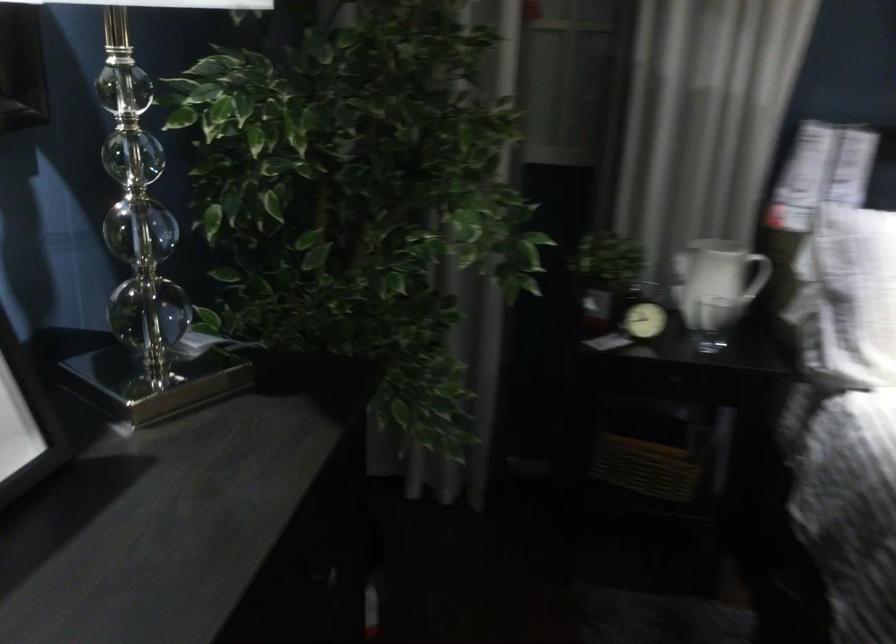
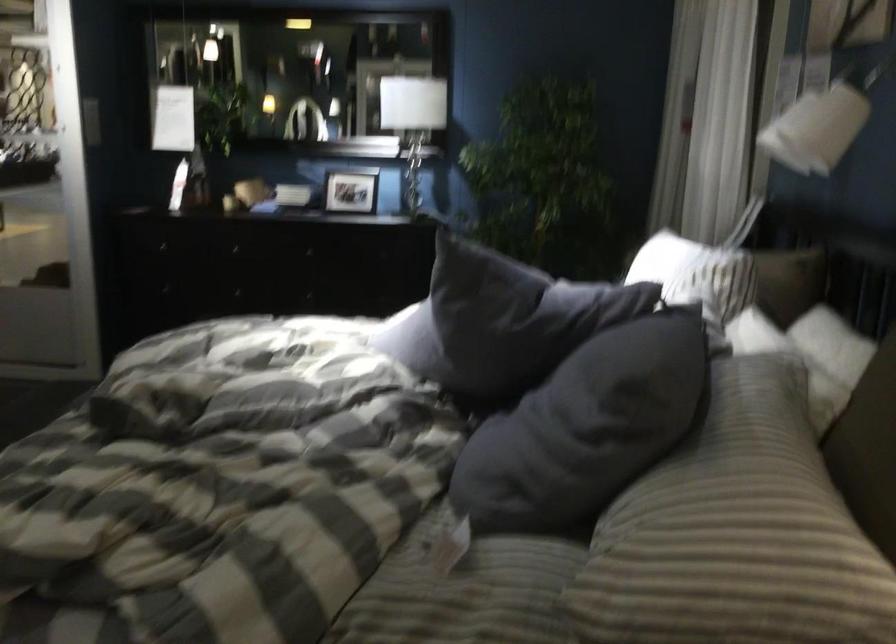
Question: I am providing you with two images of the same scene from different viewpoints. Please identify which objects are invisible in image2.

Choices:
 (A) round alarm clock
 (B) small picture frame
 (C) striped pillow
 (D) green tufted cushion

Answer: (A)